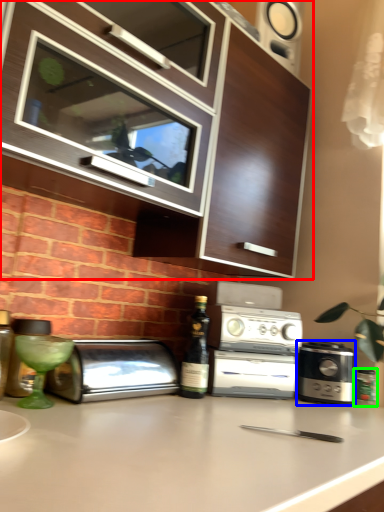
Question: Which object is positioned closest to cabinetry (highlighted by a red box)? Select from kitchen appliance (highlighted by a blue box) and bottle (highlighted by a green box).

Choices:
 (A) kitchen appliance
 (B) bottle

Answer: (A)